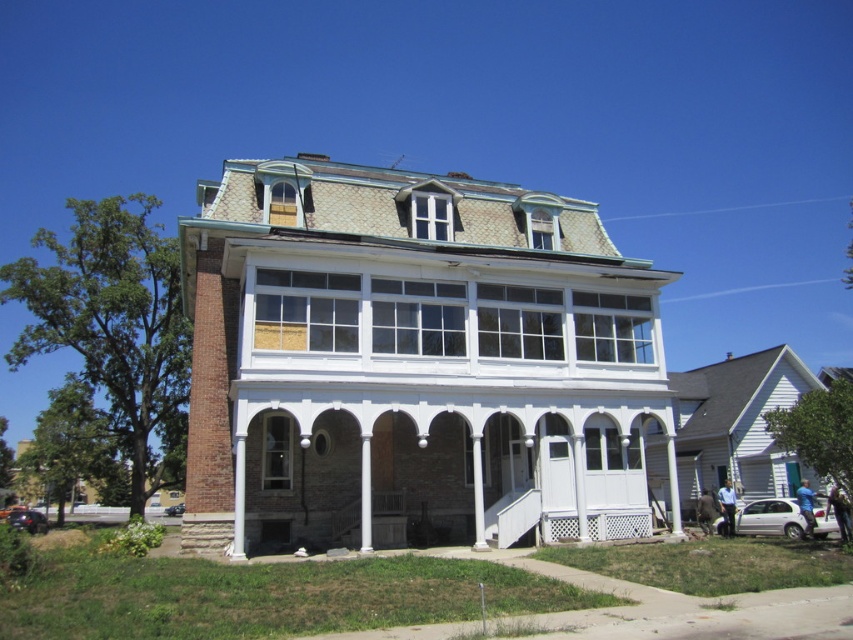
What are the coordinates of the white painted wood pillar at center in the image?

The white painted wood pillar at center is located at coordinates point (364, 493).

You are a delivery driver who needs to park your metallic orange car at lower left as close as possible to the white painted wood pillar at center without blocking the front entrance. Given the height difference between them, is there enough vertical clearance for the car to park under the pillar?

The white painted wood pillar at center has a greater height compared to the metallic orange car at lower left, so there should be sufficient vertical clearance for the car to park under the pillar without blocking the entrance.